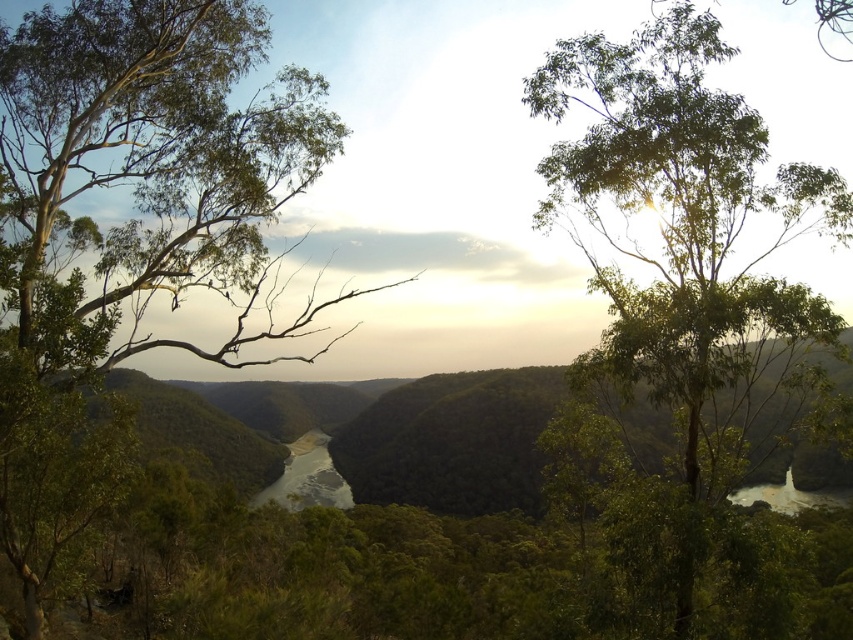
Question: Which point is farther to the camera?

Choices:
 (A) green leafy tree at left
 (B) green smooth river at center

Answer: (B)

Question: Which point is closer to the camera taking this photo?

Choices:
 (A) (213, 42)
 (B) (294, 486)
 (C) (711, 54)

Answer: (C)

Question: Among these objects, which one is farthest from the camera?

Choices:
 (A) green smooth river at center
 (B) green leafy tree at upper center

Answer: (A)

Question: Is green leafy tree at left to the right of green smooth river at center from the viewer's perspective?

Choices:
 (A) no
 (B) yes

Answer: (B)

Question: Is the position of green leafy tree at left more distant than that of green leafy tree at upper center?

Choices:
 (A) yes
 (B) no

Answer: (A)

Question: Is green leafy tree at left smaller than green smooth river at center?

Choices:
 (A) yes
 (B) no

Answer: (B)